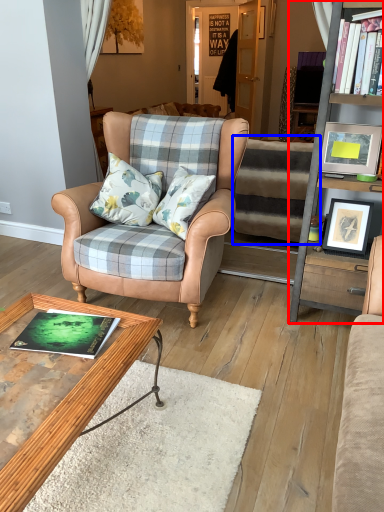
Question: Which object is closer to the camera taking this photo, cabinetry (highlighted by a red box) or stairwell (highlighted by a blue box)?

Choices:
 (A) cabinetry
 (B) stairwell

Answer: (A)